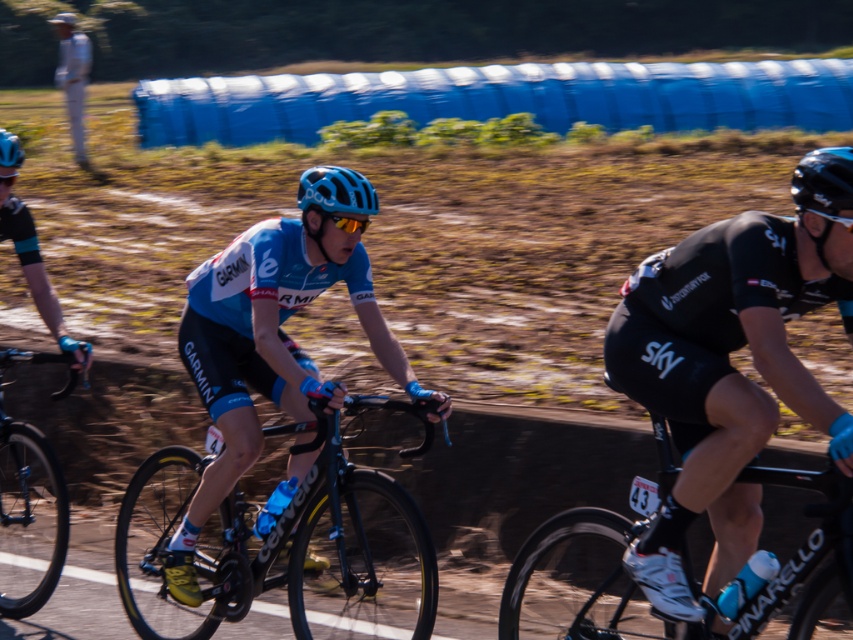
What do you see at coordinates (822, 179) in the screenshot? This screenshot has width=853, height=640. I see `black matte helmet at upper right` at bounding box center [822, 179].

In the scene shown: Who is shorter, black matte helmet at upper right or blue matte helmet at center?

blue matte helmet at center is shorter.

Is point (816, 166) more distant than point (310, 198)?

No.

The image size is (853, 640). In order to click on black matte helmet at upper right in this screenshot , I will do `click(822, 179)`.

Can you confirm if black matte helmet at upper right is positioned to the right of matte blue helmet at center?

Yes, black matte helmet at upper right is to the right of matte blue helmet at center.

This screenshot has width=853, height=640. I want to click on black matte helmet at upper right, so click(822, 179).

What are the coordinates of `black matte helmet at upper right` in the screenshot? It's located at (822, 179).

In the scene shown: Measure the distance between black carbon fiber bicycle at center and camera.

black carbon fiber bicycle at center is 5.33 meters from camera.

Locate an element on the screen. black carbon fiber bicycle at center is located at coordinates (281, 547).